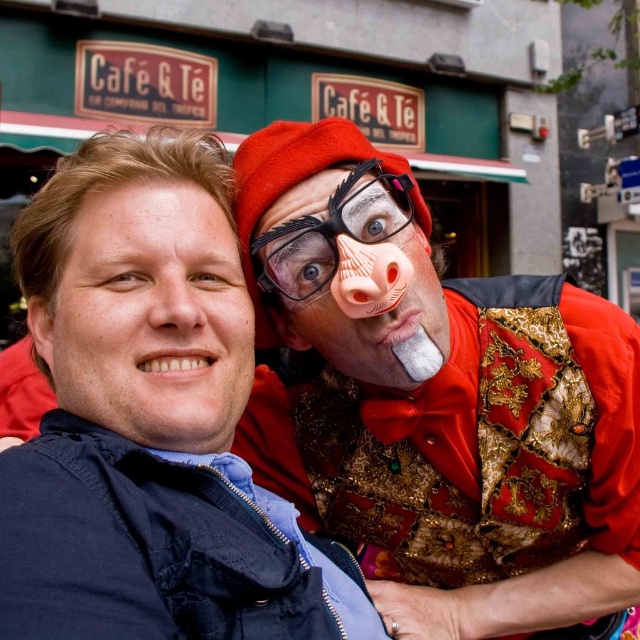
You are designing a layout for a magazine cover and need to place two elements based on their widths. The matte gold vest at right and the matte skin face at left are the elements. Which element should you place on the left side of the cover if you want the wider element to be on the right side?

The matte gold vest at right is wider than the matte skin face at left. Therefore, to have the wider element on the right side of the cover, you should place the matte skin face at left on the left side and the matte gold vest at right on the right side.

Looking at this image, you are standing in front of the cafe and want to take a photo of the blue fabric jacket at center and the matte gold vest at right. Which object should you focus on first if you want to capture both in the same frame without moving the camera?

You should focus on the blue fabric jacket at center first because the matte gold vest at right is positioned to the right of it, so keeping the jacket centered will ensure both are in frame.